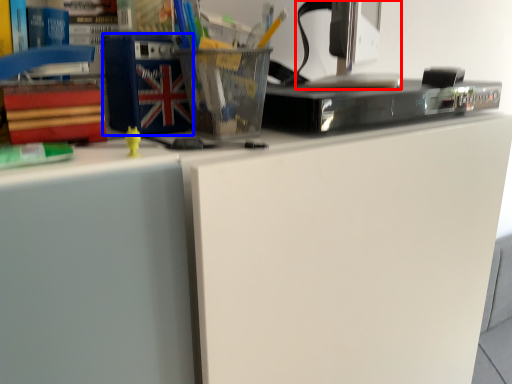
Question: Which object is further to the camera taking this photo, desktop computer (highlighted by a red box) or paperback book (highlighted by a blue box)?

Choices:
 (A) desktop computer
 (B) paperback book

Answer: (A)